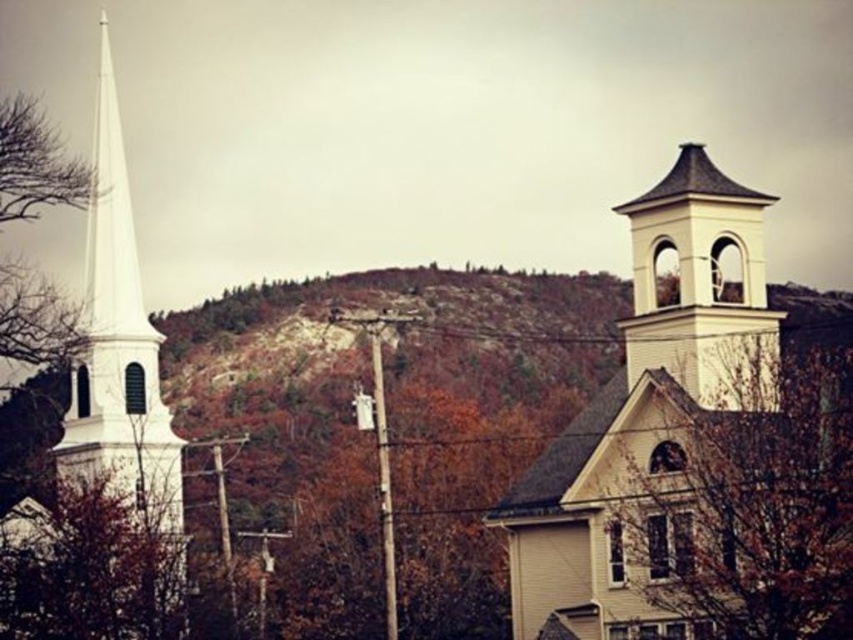
Question: Which point is farther to the camera?

Choices:
 (A) white matte bell tower at upper right
 (B) brown matte tree at center-right
 (C) white smooth steeple at left

Answer: (C)

Question: Considering the real-world distances, which object is farthest from the white painted wood bell tower at upper right?

Choices:
 (A) white smooth steeple at left
 (B) white matte bell tower at upper right
 (C) brown matte tree at center-right

Answer: (A)

Question: Which of the following is the closest to the observer?

Choices:
 (A) white smooth steeple at left
 (B) white matte bell tower at upper right
 (C) brown matte tree at center-right

Answer: (C)

Question: Is the position of white smooth steeple at left more distant than that of white painted wood bell tower at upper right?

Choices:
 (A) no
 (B) yes

Answer: (B)

Question: Is white matte bell tower at upper right below brown matte tree at center-right?

Choices:
 (A) yes
 (B) no

Answer: (A)

Question: Where is white matte bell tower at upper right located in relation to brown matte tree at center-right in the image?

Choices:
 (A) right
 (B) left

Answer: (B)